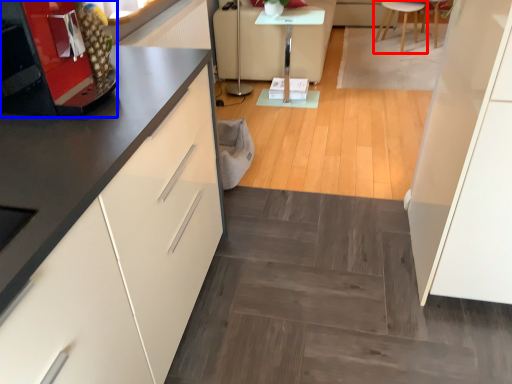
Question: Which point is closer to the camera, furniture (highlighted by a red box) or appliance (highlighted by a blue box)?

Choices:
 (A) furniture
 (B) appliance

Answer: (B)